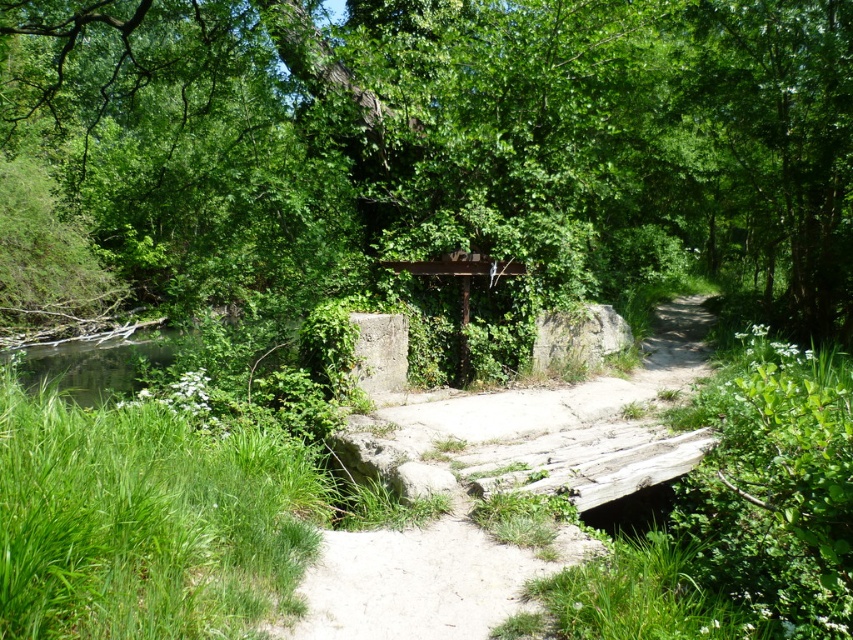
Question: Which point is closer to the camera?

Choices:
 (A) (390, 234)
 (B) (460, 566)

Answer: (B)

Question: Does green leafy tree at center appear over concrete bridge at center?

Choices:
 (A) no
 (B) yes

Answer: (B)

Question: Does green leafy tree at center have a lesser width compared to concrete bridge at center?

Choices:
 (A) yes
 (B) no

Answer: (B)

Question: Among these points, which one is nearest to the camera?

Choices:
 (A) (601, 397)
 (B) (125, 273)

Answer: (A)

Question: Which point is farther from the camera taking this photo?

Choices:
 (A) (370, 618)
 (B) (784, 186)

Answer: (B)

Question: Is green leafy tree at center above concrete bridge at center?

Choices:
 (A) yes
 (B) no

Answer: (A)